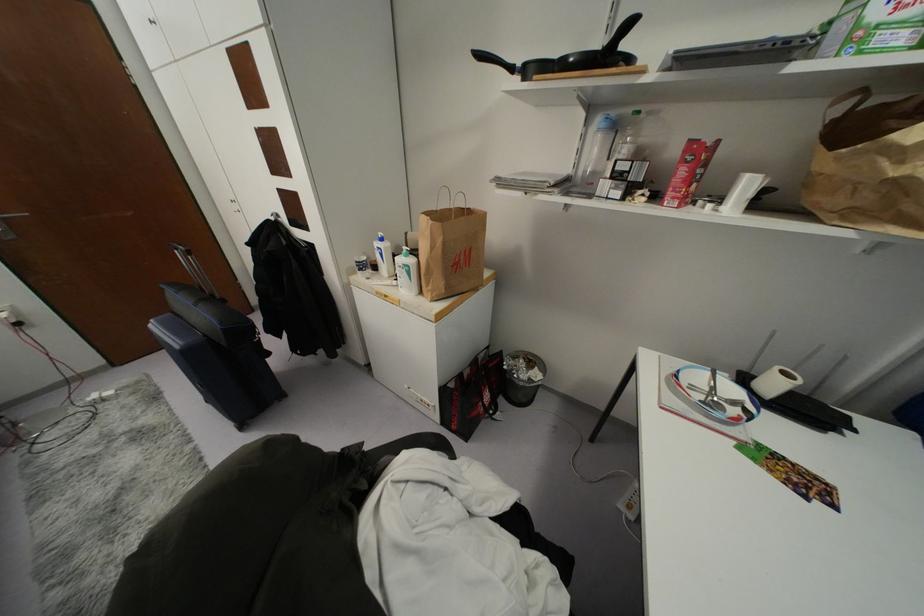
This screenshot has height=616, width=924. What do you see at coordinates (180, 249) in the screenshot?
I see `the suitcase telescoping handle` at bounding box center [180, 249].